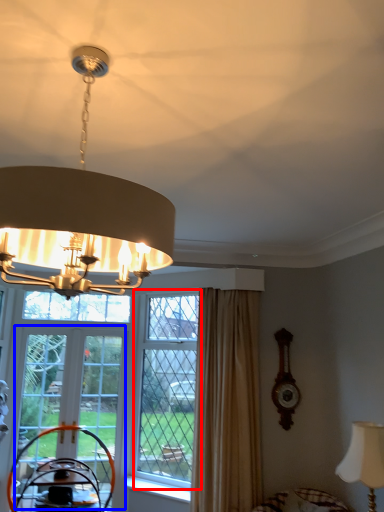
Question: Which object appears farthest to the camera in this image, window (highlighted by a red box) or screen door (highlighted by a blue box)?

Choices:
 (A) window
 (B) screen door

Answer: (B)